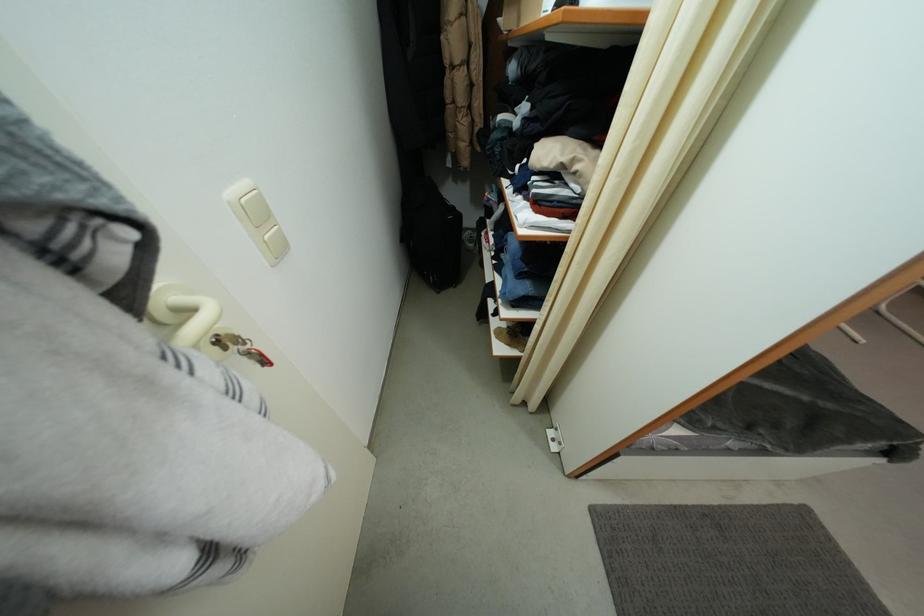
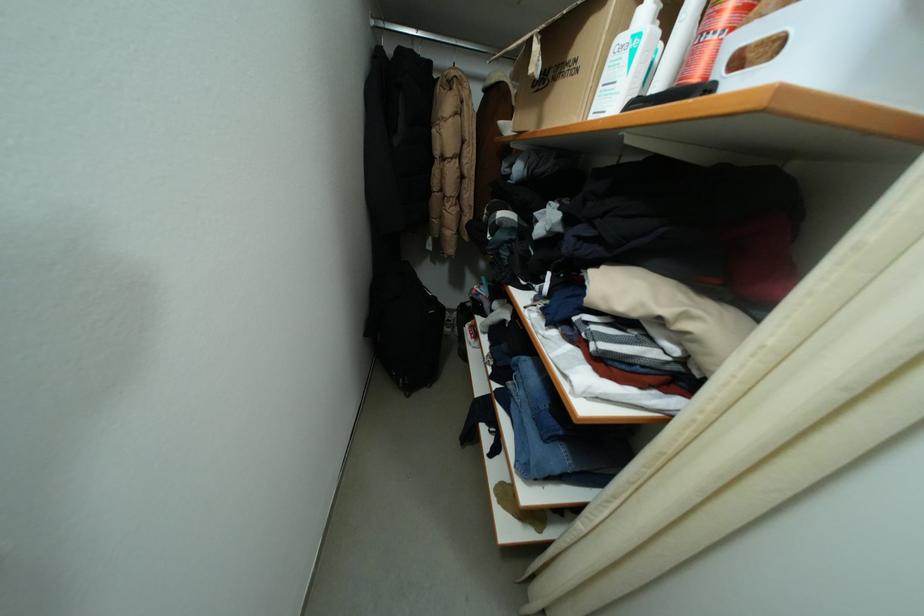
Question: In a continuous first-person perspective shot, in which direction is the camera moving?

Choices:
 (A) Left
 (B) Right
 (C) Forward
 (D) Backward

Answer: (C)